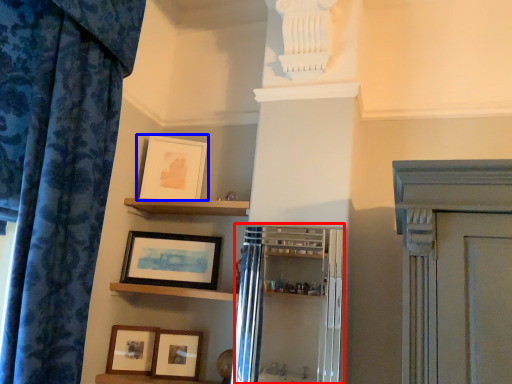
Question: Which of the following is the closest to the observer, cabinetry (highlighted by a red box) or picture frame (highlighted by a blue box)?

Choices:
 (A) cabinetry
 (B) picture frame

Answer: (A)